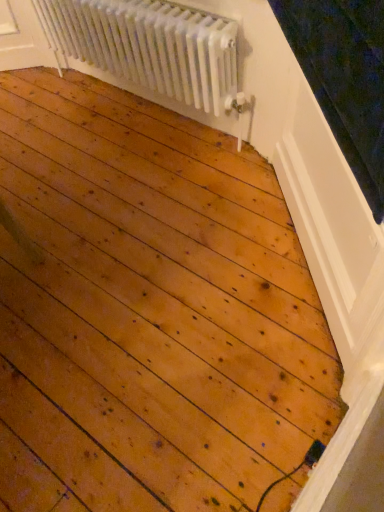
Question: Is white metallic radiator at upper center facing towards wooden at lower right?

Choices:
 (A) yes
 (B) no

Answer: (B)

Question: Can wooden at lower right be found inside white metallic radiator at upper center?

Choices:
 (A) yes
 (B) no

Answer: (B)

Question: From the image's perspective, does white metallic radiator at upper center appear higher than wooden at lower right?

Choices:
 (A) no
 (B) yes

Answer: (B)

Question: From a real-world perspective, is white metallic radiator at upper center located higher than wooden at lower right?

Choices:
 (A) yes
 (B) no

Answer: (A)

Question: Is white metallic radiator at upper center at the left side of wooden at lower right?

Choices:
 (A) yes
 (B) no

Answer: (A)

Question: Is white metallic radiator at upper center completely or partially outside of wooden at lower right?

Choices:
 (A) no
 (B) yes

Answer: (B)

Question: Is wooden at lower right bigger than white metallic radiator at upper center?

Choices:
 (A) no
 (B) yes

Answer: (A)

Question: Is wooden at lower right to the right of white metallic radiator at upper center from the viewer's perspective?

Choices:
 (A) yes
 (B) no

Answer: (A)

Question: Is wooden at lower right looking in the opposite direction of white metallic radiator at upper center?

Choices:
 (A) no
 (B) yes

Answer: (A)

Question: Is wooden at lower right shorter than white metallic radiator at upper center?

Choices:
 (A) yes
 (B) no

Answer: (A)

Question: Is wooden at lower right to the left of white metallic radiator at upper center from the viewer's perspective?

Choices:
 (A) yes
 (B) no

Answer: (B)

Question: From the image's perspective, is wooden at lower right on top of white metallic radiator at upper center?

Choices:
 (A) yes
 (B) no

Answer: (B)

Question: Considering the positions of wooden at lower right and white metallic radiator at upper center in the image, is wooden at lower right taller or shorter than white metallic radiator at upper center?

Choices:
 (A) tall
 (B) short

Answer: (B)